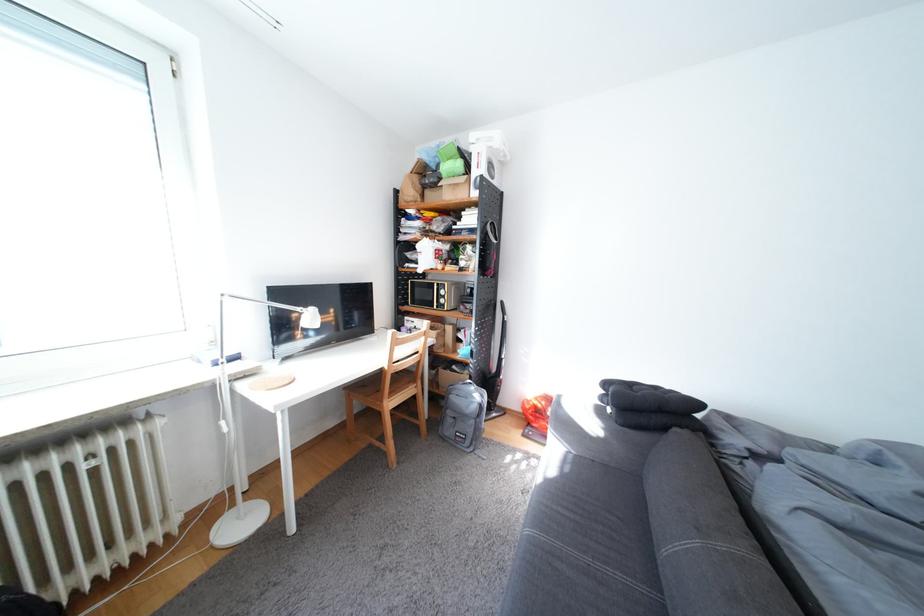
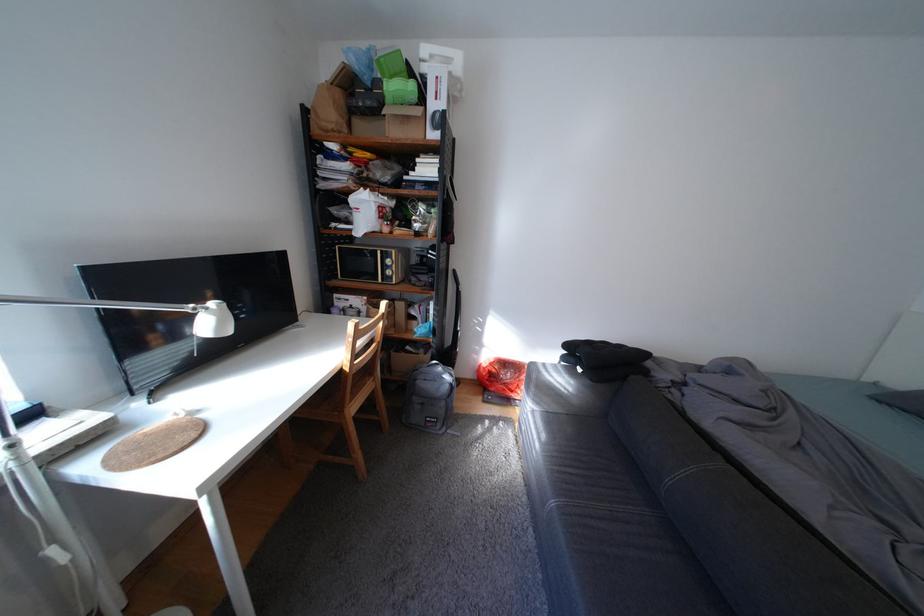
In the second image, find the point that corresponds to pixel 429 179 in the first image.

(351, 95)